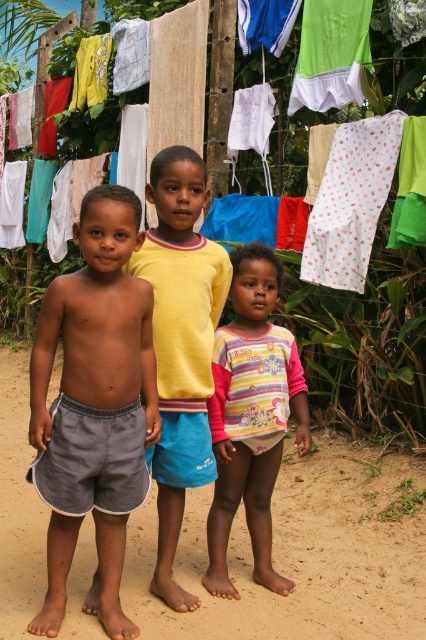
Question: Is yellow cotton shirt at center above white dotted fabric at center?

Choices:
 (A) yes
 (B) no

Answer: (B)

Question: Does white cotton pants at center appear under striped cotton shirt at center?

Choices:
 (A) no
 (B) yes

Answer: (A)

Question: Does striped cotton shirt at center have a larger size compared to white dotted fabric at center?

Choices:
 (A) no
 (B) yes

Answer: (A)

Question: Which object is the closest to the white dotted fabric at center?

Choices:
 (A) striped cotton shirt at center
 (B) gray fabric shorts at left

Answer: (A)

Question: Which object appears closest to the camera in this image?

Choices:
 (A) striped cotton shirt at center
 (B) white cotton pants at center

Answer: (A)

Question: Which point is farther from the camera taking this photo?

Choices:
 (A) (51, 525)
 (B) (204, 419)

Answer: (B)